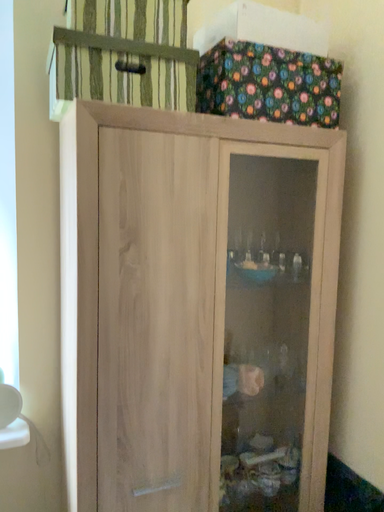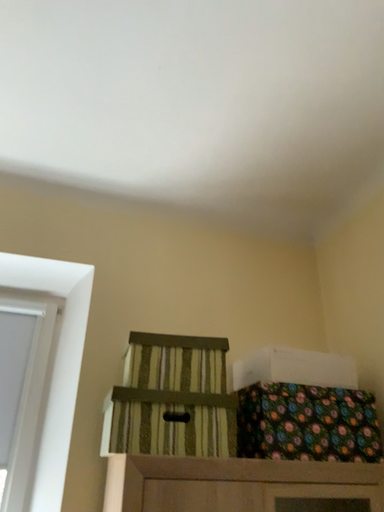
Question: Which way did the camera rotate in the video?

Choices:
 (A) rotated upward
 (B) rotated downward

Answer: (A)